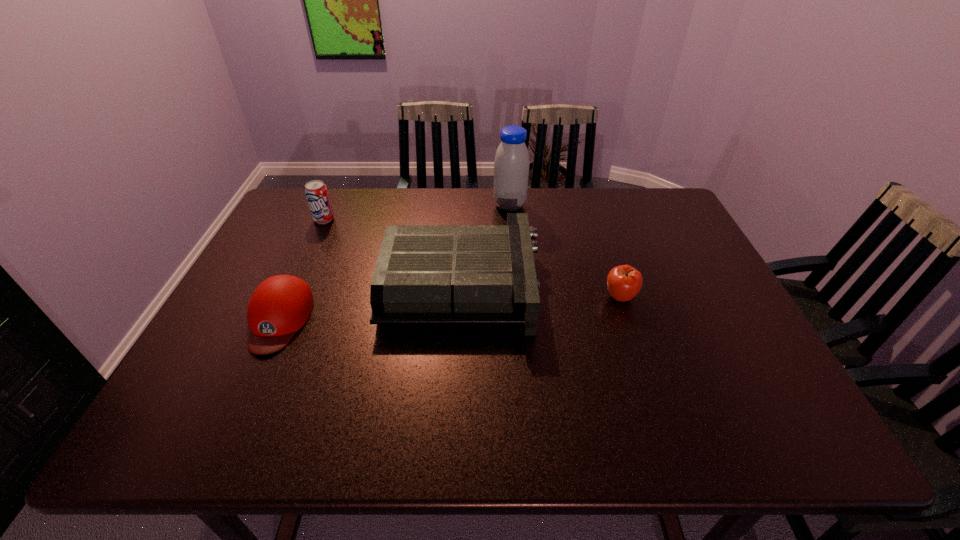
Find the location of a particular element. This screenshot has width=960, height=540. vacant space at the far right corner of the desktop is located at coordinates (673, 218).

In the image, there is a desktop. Where is `vacant space at the near right corner`? The width and height of the screenshot is (960, 540). vacant space at the near right corner is located at coordinates (755, 433).

Where is `empty space between the tallest object and the soda can`? The width and height of the screenshot is (960, 540). empty space between the tallest object and the soda can is located at coordinates (417, 212).

Find the location of a particular element. The height and width of the screenshot is (540, 960). free spot between the soda can and the baseball cap is located at coordinates (301, 269).

Where is `unoccupied position between the rightmost object and the radio receiver`? unoccupied position between the rightmost object and the radio receiver is located at coordinates (540, 291).

I want to click on empty space that is in between the apple and the radio receiver, so click(540, 291).

Identify which object is the second nearest to the radio receiver. Please provide its 2D coordinates. Your answer should be formatted as a tuple, i.e. [(x, y)], where the tuple contains the x and y coordinates of a point satisfying the conditions above.

[(624, 282)]

What are the coordinates of `object that is the second closest to the soda can` in the screenshot? It's located at [x=280, y=305].

Locate an element on the screen. The image size is (960, 540). free spot that satisfies the following two spatial constraints: 1. on the front panel of the apple; 2. on the left side of the radio receiver is located at coordinates (461, 297).

Where is `free location that satisfies the following two spatial constraints: 1. on the front side of the soya milk; 2. on the front panel of the radio receiver`? This screenshot has width=960, height=540. free location that satisfies the following two spatial constraints: 1. on the front side of the soya milk; 2. on the front panel of the radio receiver is located at coordinates (516, 285).